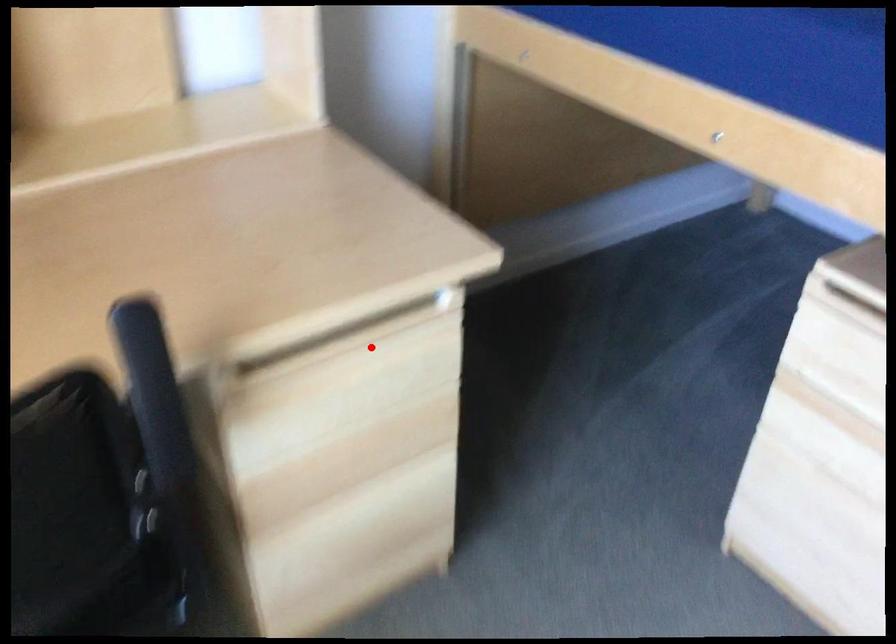
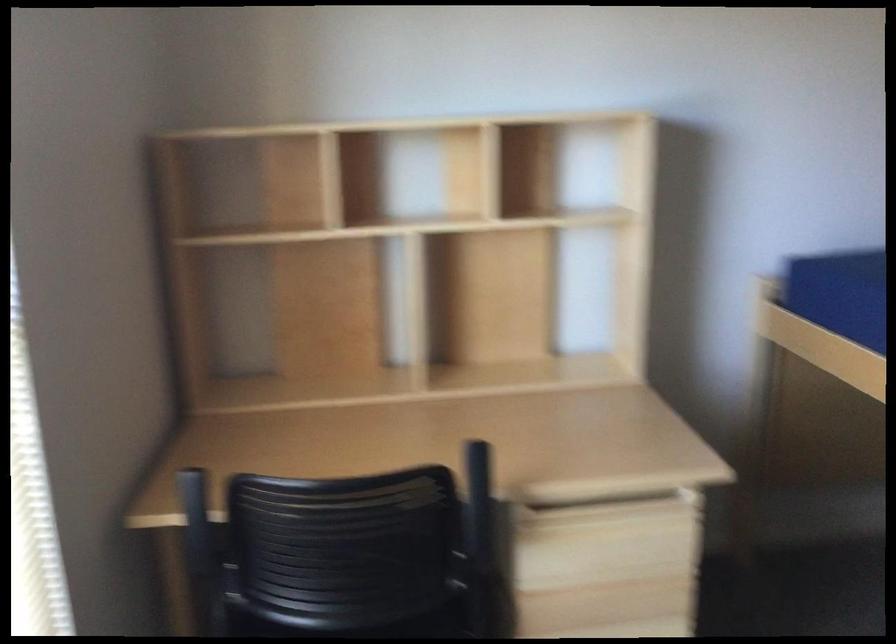
In the second image, find the point that corresponds to the highlighted location in the first image.

(616, 520)